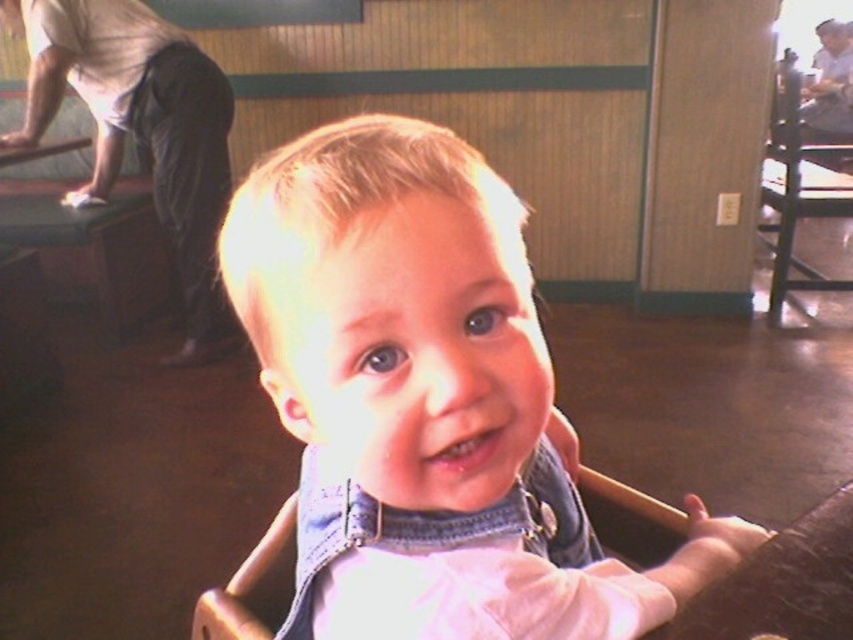
You are designing a play area for children and need to place the white matte baby at upper center and the black wood chair at right. Given their sizes, which object should be placed closer to the center of the play area to ensure balance?

The white matte baby at upper center is smaller than the black wood chair at right, so to balance the play area, the larger black wood chair at right should be placed closer to the center while the smaller white matte baby at upper center can be positioned slightly away to maintain equilibrium.

You are a photographer setting up for a family photo. You have two subjects in the frame, the denim overalls at center and the white matte baby at upper center. Which subject is narrower in width?

The denim overalls at center is thinner than the white matte baby at upper center, so the denim overalls at center is narrower in width.